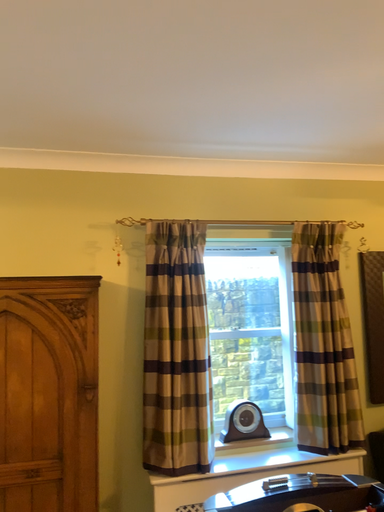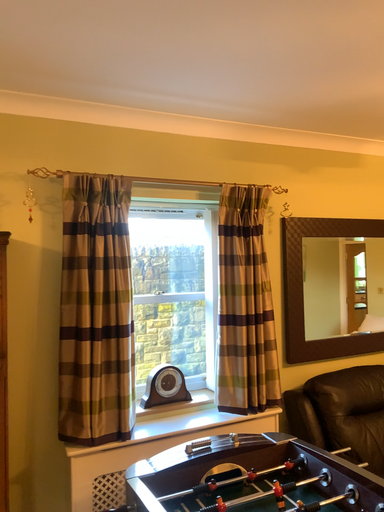
Question: How did the camera likely rotate when shooting the video?

Choices:
 (A) rotated right
 (B) rotated left

Answer: (A)